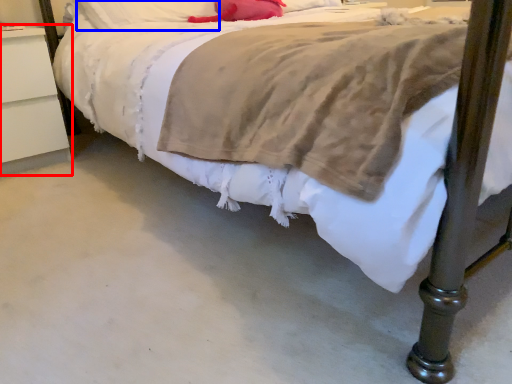
Question: Which object is closer to the camera taking this photo, nightstand (highlighted by a red box) or pillow (highlighted by a blue box)?

Choices:
 (A) nightstand
 (B) pillow

Answer: (A)